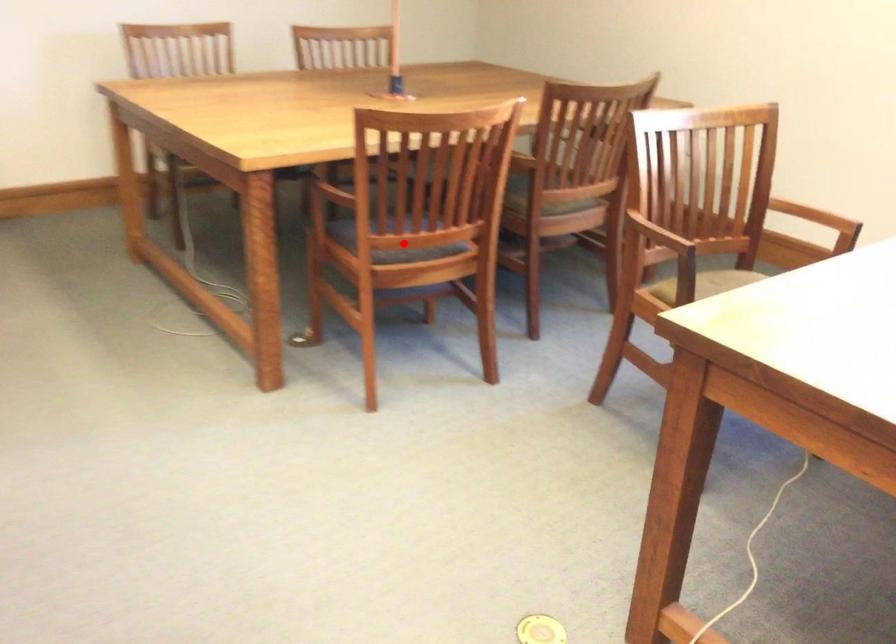
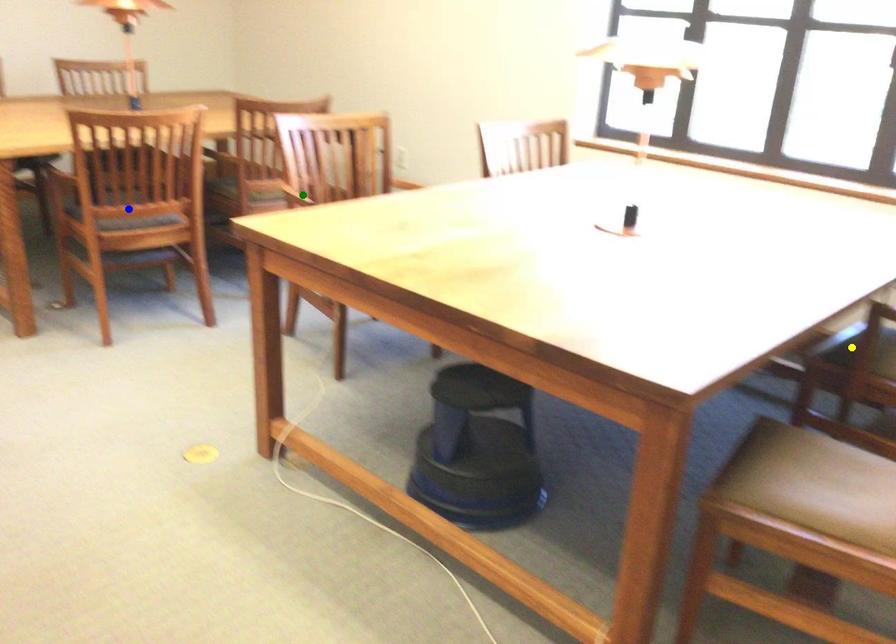
Question: I am providing you with two images of the same scene from different viewpoints. A red point is marked on the first image. You are given multiple points on the second image. Which mark in image 2 goes with the point in image 1?

Choices:
 (A) blue point
 (B) yellow point
 (C) green point

Answer: (A)